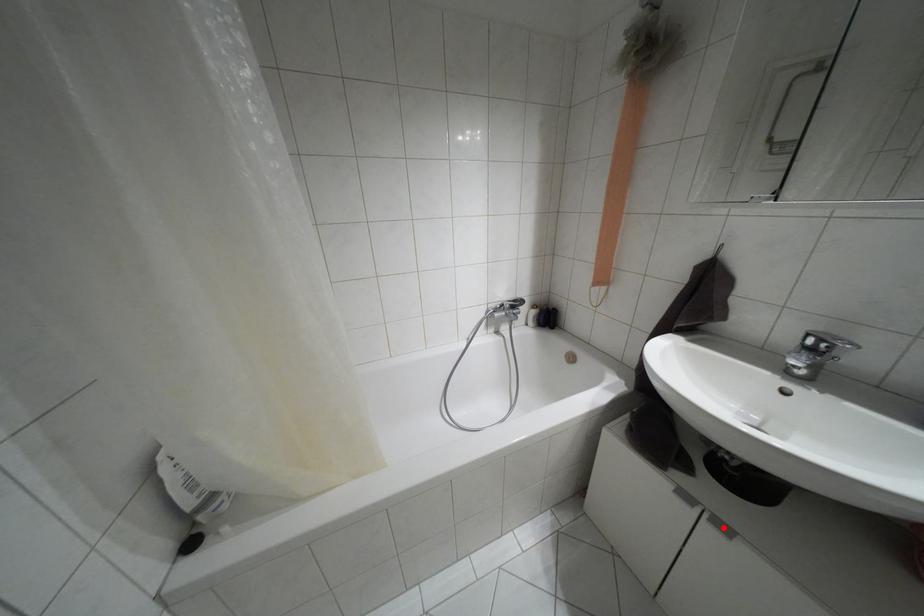
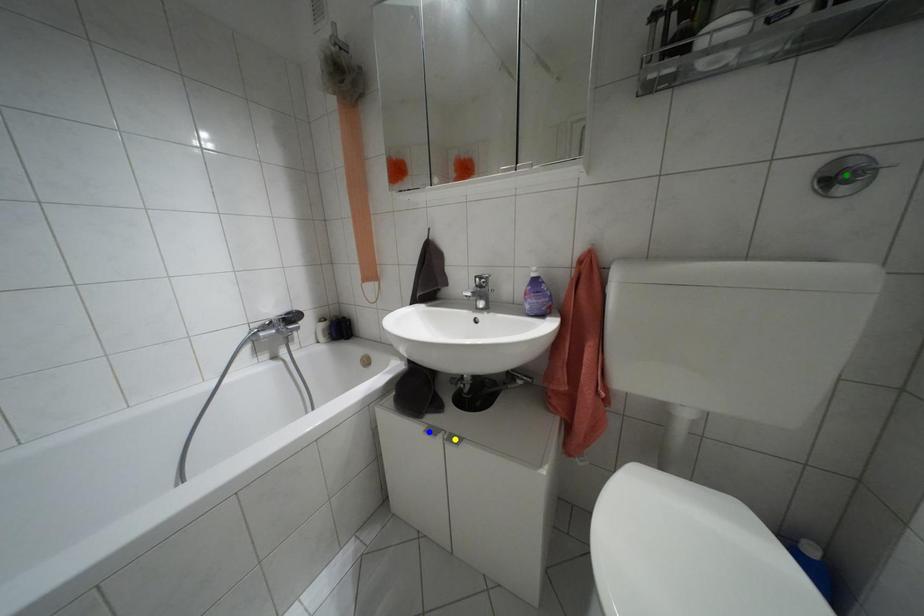
Question: I am providing you with two images of the same scene from different viewpoints. A red point is marked on the first image. You are given multiple points on the second image. Which point in image 2 represents the same 3d spot as the red point in image 1?

Choices:
 (A) yellow point
 (B) blue point
 (C) green point

Answer: (A)